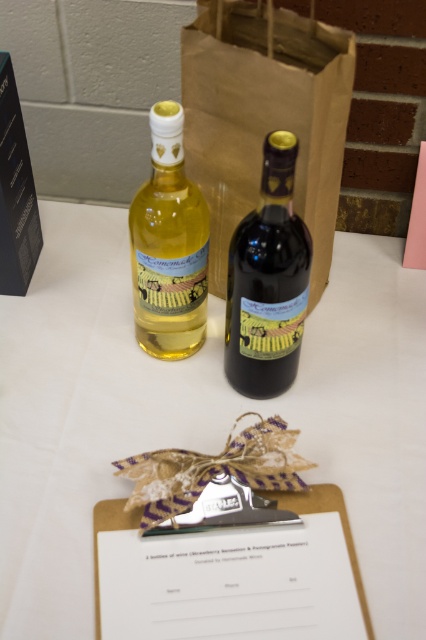
Which of these two, white cloth at center or dark glass bottle at center, stands taller?

white cloth at center

Does white cloth at center come in front of dark glass bottle at center?

No, it is behind dark glass bottle at center.

The image size is (426, 640). Identify the location of white cloth at center. (199, 416).

What are the coordinates of `white cloth at center` in the screenshot? It's located at (199, 416).

Measure the distance between brown paper bag at center and matte glass bottle at upper left.

They are 5.21 inches apart.

Where is `brown paper bag at center`? The width and height of the screenshot is (426, 640). brown paper bag at center is located at coordinates (264, 116).

What do you see at coordinates (264, 116) in the screenshot? I see `brown paper bag at center` at bounding box center [264, 116].

Where is `brown paper bag at center`? This screenshot has width=426, height=640. brown paper bag at center is located at coordinates (264, 116).